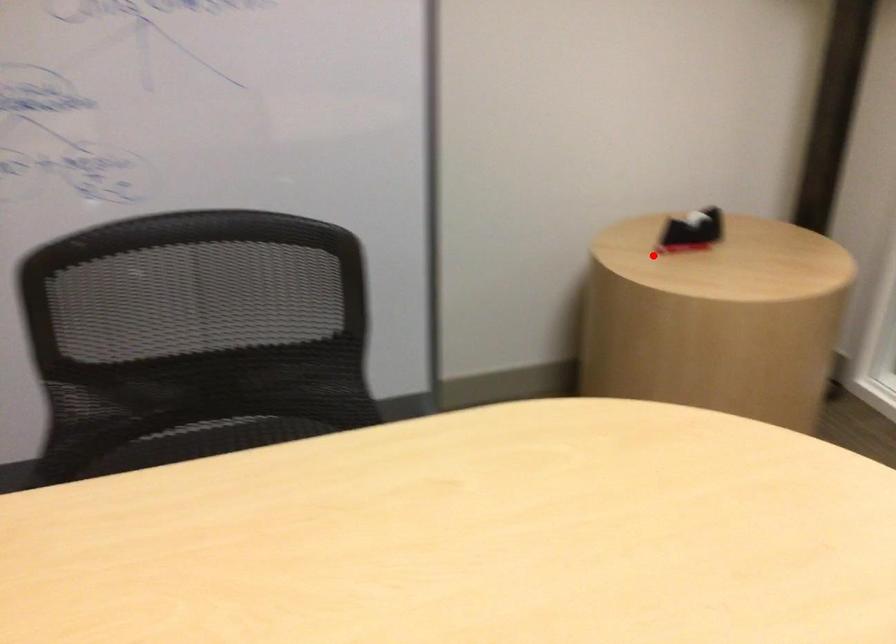
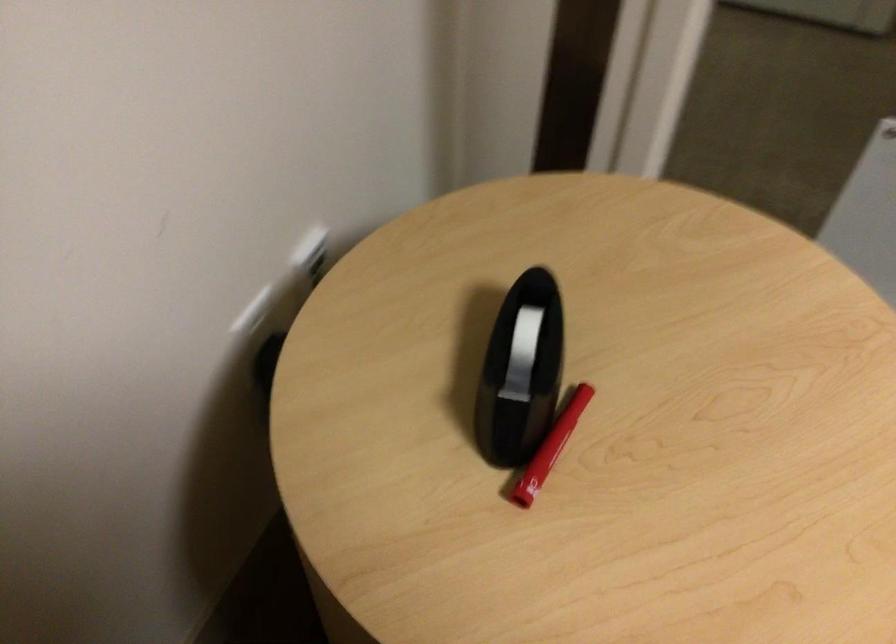
Question: A red point is marked in image1. In image2, is the corresponding 3D point closer to the camera or farther? Reply with the corresponding letter.

Choices:
 (A) The corresponding 3D point is closer.
 (B) The corresponding 3D point is farther.

Answer: (A)